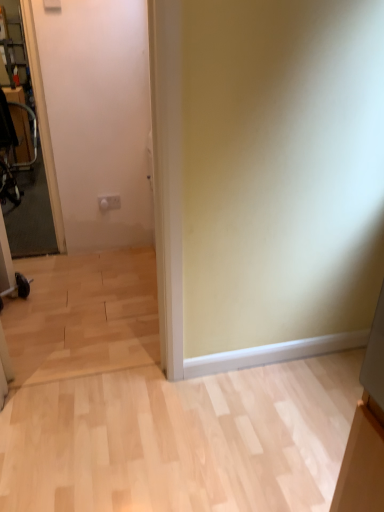
Question: Considering their positions, is transparent glass door at left located in front of or behind metallic silver swivel chair at left?

Choices:
 (A) front
 (B) behind

Answer: (A)

Question: In terms of height, does transparent glass door at left look taller or shorter compared to metallic silver swivel chair at left?

Choices:
 (A) tall
 (B) short

Answer: (A)

Question: Based on their sizes in the image, would you say transparent glass door at left is bigger or smaller than metallic silver swivel chair at left?

Choices:
 (A) small
 (B) big

Answer: (A)

Question: In terms of height, does metallic silver swivel chair at left look taller or shorter compared to transparent glass door at left?

Choices:
 (A) tall
 (B) short

Answer: (B)

Question: From a real-world perspective, is metallic silver swivel chair at left physically located above or below transparent glass door at left?

Choices:
 (A) below
 (B) above

Answer: (A)

Question: Does point (0, 168) appear closer or farther from the camera than point (16, 8)?

Choices:
 (A) farther
 (B) closer

Answer: (B)

Question: Considering their positions, is metallic silver swivel chair at left located in front of or behind transparent glass door at left?

Choices:
 (A) front
 (B) behind

Answer: (B)